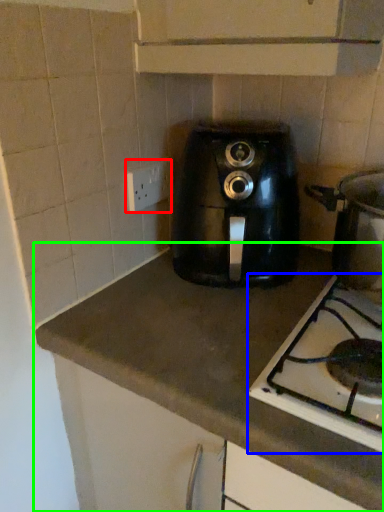
Question: Based on their relative distances, which object is farther from electric outlet (highlighted by a red box)? Choose from gas stove (highlighted by a blue box) and countertop (highlighted by a green box).

Choices:
 (A) gas stove
 (B) countertop

Answer: (A)